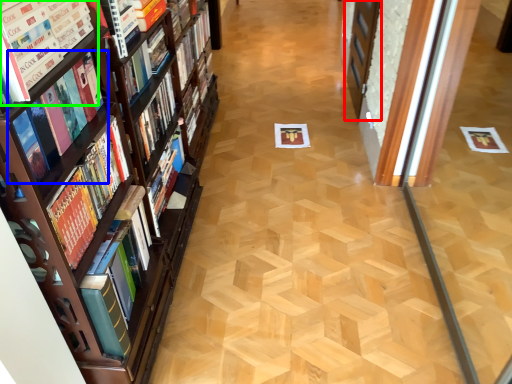
Question: Which is farther away from screen door (highlighted by a red box)? book (highlighted by a blue box) or book (highlighted by a green box)?

Choices:
 (A) book
 (B) book

Answer: (B)